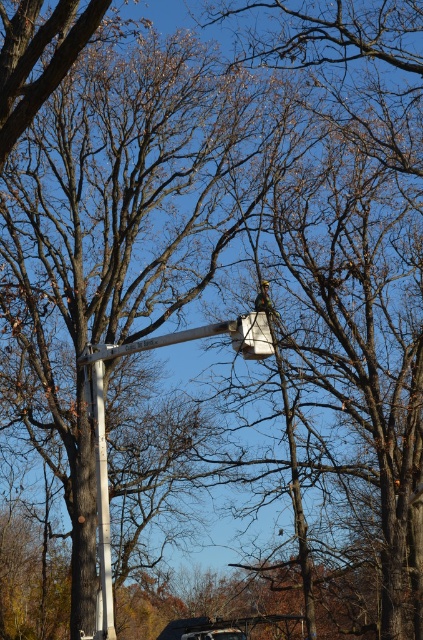
Based on the scene description, where is the white metallic street light at upper center located in the image?

The white metallic street light at upper center is located at point (x=104, y=432) in the image.

You are a city planner evaluating the placement of the white metallic street light at upper center and the white plastic pole at center. Based on their widths, which one might require more space in the surrounding area for installation?

The white metallic street light at upper center might require more space in the surrounding area for installation since it is wider than the white plastic pole at center according to the description.